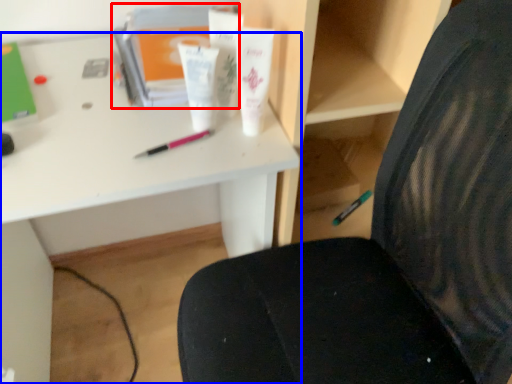
Question: Among these objects, which one is nearest to the camera, book (highlighted by a red box) or desk (highlighted by a blue box)?

Choices:
 (A) book
 (B) desk

Answer: (B)